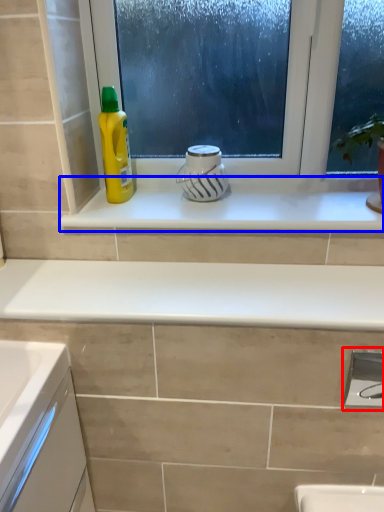
Question: Among these objects, which one is farthest to the camera, faucet (highlighted by a red box) or window sill (highlighted by a blue box)?

Choices:
 (A) faucet
 (B) window sill

Answer: (B)